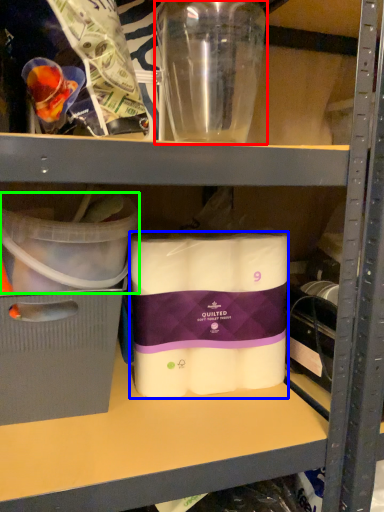
Question: Which object is the farthest from bottle (highlighted by a red box)? Choose among these: toilet paper (highlighted by a blue box) or storage box (highlighted by a green box).

Choices:
 (A) toilet paper
 (B) storage box

Answer: (A)